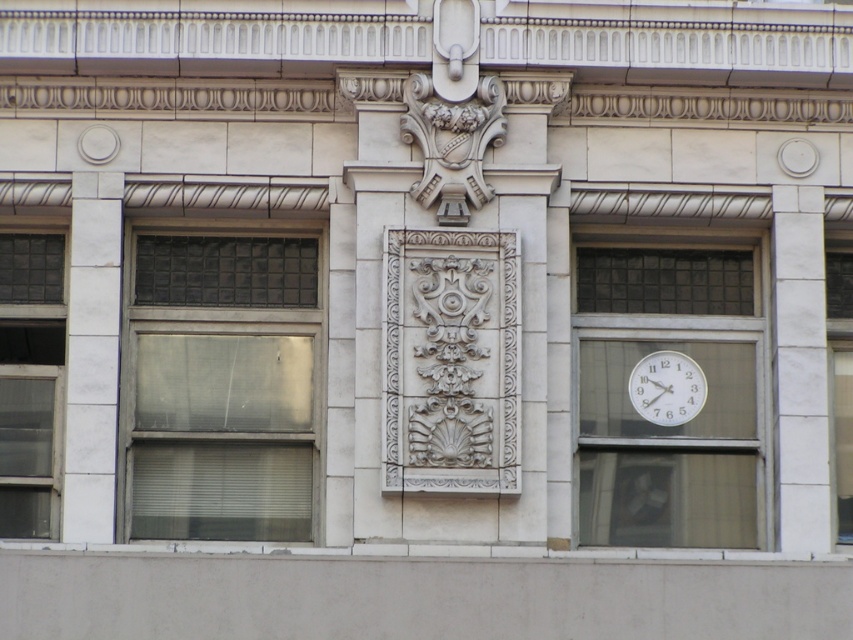
Can you confirm if clear glass window at left is positioned above white glossy clock at upper right?

No.

The width and height of the screenshot is (853, 640). Find the location of `clear glass window at left`. clear glass window at left is located at coordinates (30, 381).

Who is positioned more to the right, clear glass window at center or white glossy clock at upper right?

clear glass window at center

Does clear glass window at center appear on the left side of white glossy clock at upper right?

Incorrect, clear glass window at center is not on the left side of white glossy clock at upper right.

Image resolution: width=853 pixels, height=640 pixels. I want to click on clear glass window at center, so pos(840,378).

Who is lower down, matte glass window at left or white glossy clock at upper right?

white glossy clock at upper right

Which is more to the right, matte glass window at left or white glossy clock at upper right?

Positioned to the right is white glossy clock at upper right.

Image resolution: width=853 pixels, height=640 pixels. What do you see at coordinates (222, 385) in the screenshot?
I see `matte glass window at left` at bounding box center [222, 385].

Identify the location of matte glass window at left. The width and height of the screenshot is (853, 640). (222, 385).